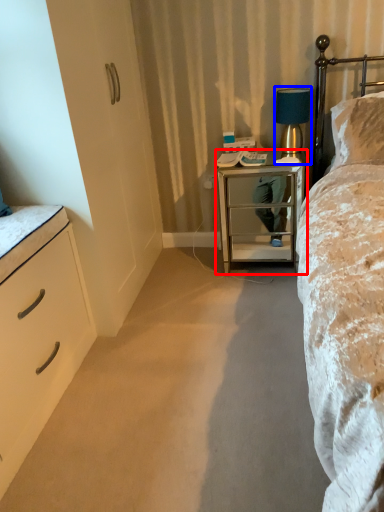
Question: Among these objects, which one is farthest to the camera, nightstand (highlighted by a red box) or table lamp (highlighted by a blue box)?

Choices:
 (A) nightstand
 (B) table lamp

Answer: (B)